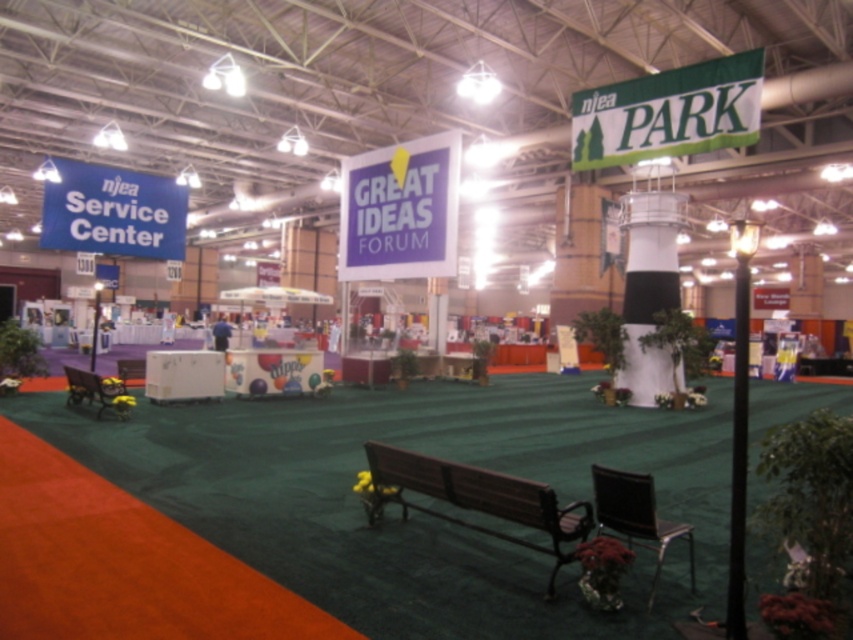
Question: Observing the image, what is the correct spatial positioning of wooden bench at center in reference to wooden park bench at left?

Choices:
 (A) below
 (B) above

Answer: (A)

Question: Which of these objects is positioned farthest from the wooden bench at center?

Choices:
 (A) wooden park bench at left
 (B) brown leather bench at lower center
 (C) purple paper sign at center

Answer: (A)

Question: Which of the following is the farthest from the observer?

Choices:
 (A) (512, 486)
 (B) (643, 483)

Answer: (A)

Question: Does purple paper sign at center have a greater width compared to brown leather bench at lower center?

Choices:
 (A) yes
 (B) no

Answer: (B)

Question: From the image, what is the correct spatial relationship of wooden bench at center in relation to wooden park bench at left?

Choices:
 (A) right
 (B) left

Answer: (A)

Question: Which point is farther from the camera taking this photo?

Choices:
 (A) (68, 403)
 (B) (447, 237)

Answer: (A)